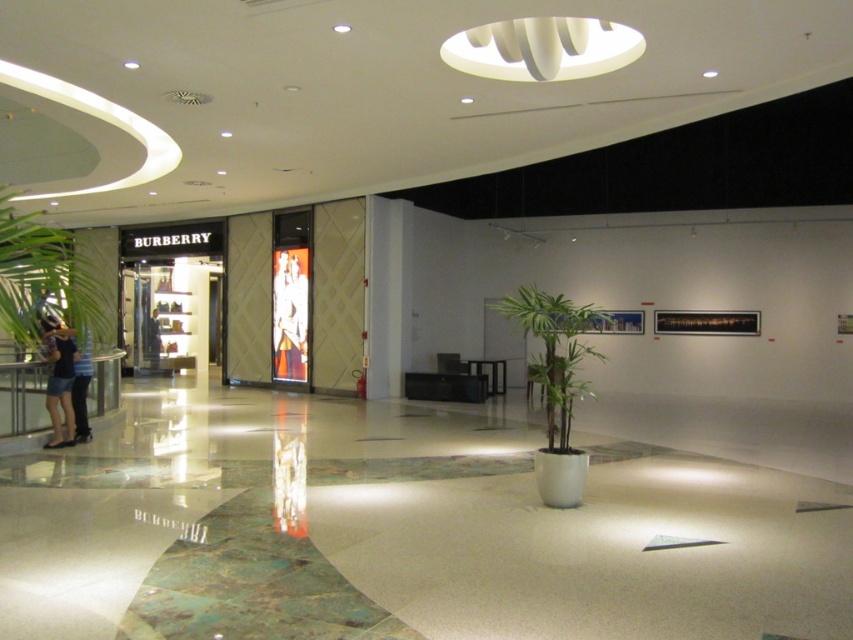
You are standing in the shopping mall and want to walk towards the entrance of the Burberry store. There are two points marked on the floor, point(62, 356) and point(77, 400). Which point should you step on first to reach the store entrance?

You should step on point(62, 356) first because it is in front of point(77, 400), meaning it is closer to the store entrance.

You are standing in the shopping mall and want to walk towards the point closer to you. Which point should you head towards, point (537, 332) or point (76, 365)?

You should head towards point (537, 332) because it is closer to the viewer compared to point (76, 365).